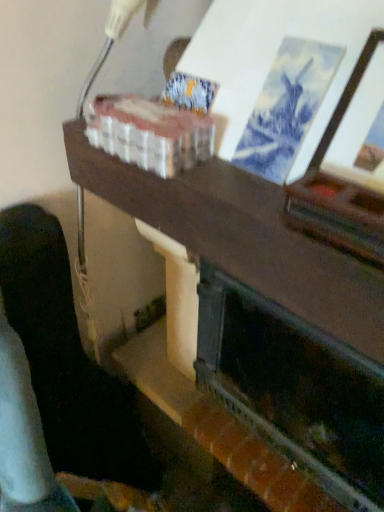
Identify the location of dark wood shelf at lower left. This screenshot has width=384, height=512. (56, 373).

Where is `dark wood table at center`? This screenshot has height=512, width=384. dark wood table at center is located at coordinates (260, 333).

Can you confirm if dark wood table at center is positioned to the left of dark green painted wood fireplace at center?

No.

From a real-world perspective, is dark wood table at center located beneath dark green painted wood fireplace at center?

No, from a real-world perspective, dark wood table at center is not beneath dark green painted wood fireplace at center.

Is dark wood table at center inside or outside of dark green painted wood fireplace at center?

→ dark wood table at center is located beyond the bounds of dark green painted wood fireplace at center.

What's the angular difference between dark wood table at center and dark green painted wood fireplace at center's facing directions?

0.000454 degrees separate the facing orientations of dark wood table at center and dark green painted wood fireplace at center.

Is dark wood shelf at lower left aimed at dark wood table at center?

No, dark wood shelf at lower left does not turn towards dark wood table at center.

Between dark wood shelf at lower left and dark wood table at center, which one has more height?

Standing taller between the two is dark wood shelf at lower left.

Is point (151, 473) closer or farther from the camera than point (198, 250)?

Point (151, 473).

Are dark green painted wood fireplace at center and dark wood shelf at lower left making contact?

No, dark green painted wood fireplace at center is not touching dark wood shelf at lower left.

Can you confirm if dark green painted wood fireplace at center is thinner than dark wood shelf at lower left?

Correct, the width of dark green painted wood fireplace at center is less than that of dark wood shelf at lower left.

Does dark green painted wood fireplace at center have a lesser height compared to dark wood shelf at lower left?

Correct, dark green painted wood fireplace at center is not as tall as dark wood shelf at lower left.

What's the angular difference between dark green painted wood fireplace at center and dark wood shelf at lower left's facing directions?

86.7 degrees separate the facing orientations of dark green painted wood fireplace at center and dark wood shelf at lower left.

Are dark green painted wood fireplace at center and dark wood table at center located far from each other?

That's not correct — dark green painted wood fireplace at center is a little close to dark wood table at center.

Consider the image. Would you say dark green painted wood fireplace at center is outside dark wood table at center?

No, most part of dark green painted wood fireplace at center lies within dark wood table at center.

Does dark green painted wood fireplace at center appear on the left side of dark wood table at center?

Yes.

From a real-world perspective, is dark green painted wood fireplace at center above or below dark wood table at center?

dark green painted wood fireplace at center is situated lower than dark wood table at center in the real world.

Is point (148, 353) less distant than point (3, 210)?

No, it is behind (3, 210).

Can you confirm if dark wood table at center is bigger than dark wood shelf at lower left?

Correct, dark wood table at center is larger in size than dark wood shelf at lower left.

Locate an element on the screen. The image size is (384, 512). table above the dark wood shelf at lower left (from the image's perspective) is located at coordinates (260, 333).

Is dark wood table at center far from dark wood shelf at lower left?

No, there isn't a large distance between dark wood table at center and dark wood shelf at lower left.

The height and width of the screenshot is (512, 384). What are the coordinates of `furniture on the left side of dark green painted wood fireplace at center` in the screenshot? It's located at (56, 373).

Is dark wood shelf at lower left inside the boundaries of dark green painted wood fireplace at center, or outside?

dark wood shelf at lower left lies outside dark green painted wood fireplace at center.

Is dark wood shelf at lower left wider or thinner than dark green painted wood fireplace at center?

In the image, dark wood shelf at lower left appears to be wider than dark green painted wood fireplace at center.

From the image's perspective, is dark wood shelf at lower left positioned above or below dark green painted wood fireplace at center?

dark wood shelf at lower left is situated lower than dark green painted wood fireplace at center in the image.

Image resolution: width=384 pixels, height=512 pixels. Find the location of `fireplace that appears below the dark wood table at center (from the image's perspective)`. fireplace that appears below the dark wood table at center (from the image's perspective) is located at coordinates (294, 389).

Locate an element on the screen. table in front of the dark wood shelf at lower left is located at coordinates (260, 333).

When comparing their distances from dark green painted wood fireplace at center, does dark wood table at center or dark wood shelf at lower left seem closer?

dark wood table at center is positioned closer to the anchor dark green painted wood fireplace at center.

In the scene shown: From the image, which object appears to be farther from dark wood table at center, dark green painted wood fireplace at center or dark wood shelf at lower left?

dark wood shelf at lower left is positioned further to the anchor dark wood table at center.

When comparing their distances from dark wood shelf at lower left, does dark wood table at center or dark green painted wood fireplace at center seem further?

dark green painted wood fireplace at center lies further to dark wood shelf at lower left than the other object.

Which object lies further to the anchor point dark wood shelf at lower left, dark green painted wood fireplace at center or dark wood table at center?

dark green painted wood fireplace at center.

Estimate the real-world distances between objects in this image. Which object is further from dark wood table at center, dark wood shelf at lower left or dark green painted wood fireplace at center?

dark wood shelf at lower left.

Which object lies further to the anchor point dark green painted wood fireplace at center, dark wood shelf at lower left or dark wood table at center?

dark wood shelf at lower left lies further to dark green painted wood fireplace at center than the other object.

Where is `fireplace between dark wood shelf at lower left and dark wood table at center from left to right`? The height and width of the screenshot is (512, 384). fireplace between dark wood shelf at lower left and dark wood table at center from left to right is located at coordinates (294, 389).